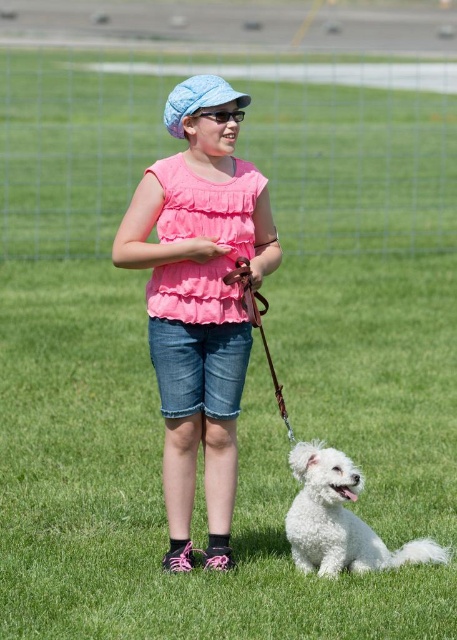
You are a photographer setting up a shot of the girl and her dog. You notice the brown leather leash at center and the matte black goggles at center. Which object should you focus on first if you want to capture the larger object in detail?

The brown leather leash at center is bigger than the matte black goggles at center, so you should focus on the brown leather leash at center first to capture the larger object in detail.

You are a photographer setting up a tripod to take a photo of the white fluffy dog at lower right and the matte black goggles at center. Since you want to focus on the taller object, which one should you adjust your camera settings for?

The white fluffy dog at lower right is taller than the matte black goggles at center, so you should adjust your camera settings to focus on the white fluffy dog at lower right.